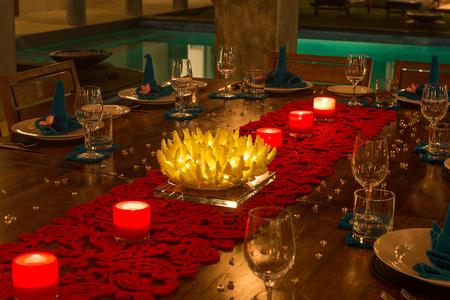
I want to click on bowl, so click(x=76, y=54).